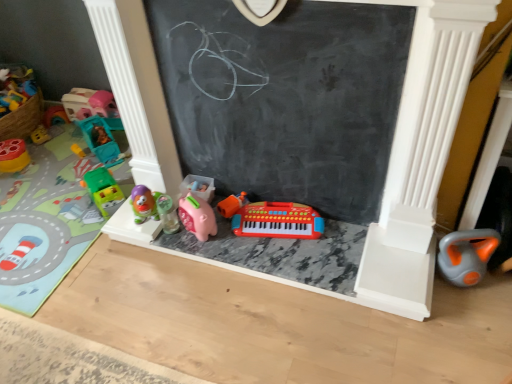
I want to click on free space in front of green plastic toy car at left, which is the 4th toy from right to left, so click(86, 230).